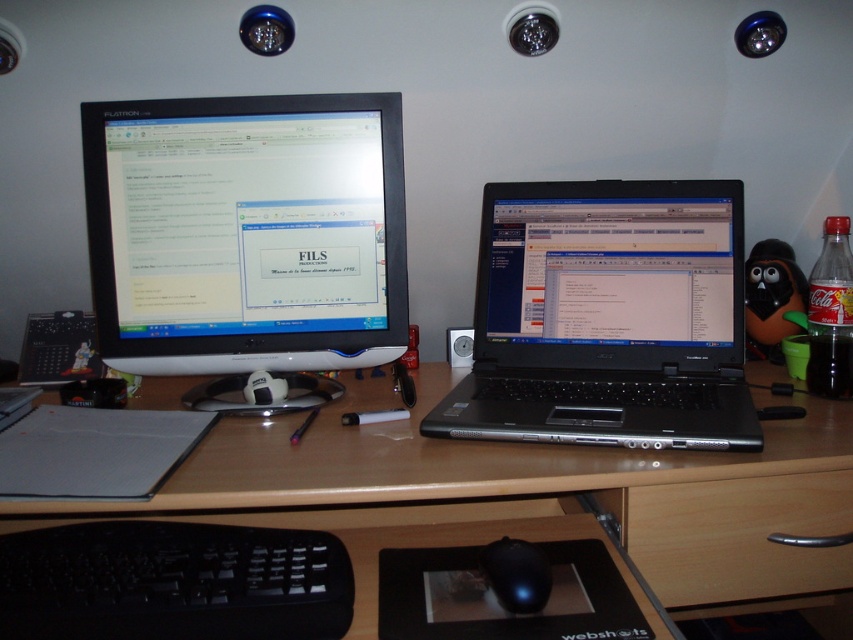
Is point (154, 609) positioned after point (469, 609)?

No, (154, 609) is closer to viewer.

Is black plastic keyboard at lower left above black matte mouse at center?

Indeed, black plastic keyboard at lower left is positioned over black matte mouse at center.

Locate an element on the screen. The image size is (853, 640). black plastic keyboard at lower left is located at coordinates [x=173, y=582].

This screenshot has height=640, width=853. Find the location of `black plastic keyboard at lower left`. black plastic keyboard at lower left is located at coordinates (173, 582).

Consider the image. Can you confirm if wooden at lower right is smaller than black matte mouse at center?

Incorrect, wooden at lower right is not smaller in size than black matte mouse at center.

Is wooden at lower right to the left of black matte mouse at center from the viewer's perspective?

In fact, wooden at lower right is to the right of black matte mouse at center.

Is point (824, 490) less distant than point (590, 572)?

No, it is behind (590, 572).

Locate an element on the screen. The height and width of the screenshot is (640, 853). wooden at lower right is located at coordinates (737, 536).

Is point (253, 481) closer to camera compared to point (656, 240)?

Yes, point (253, 481) is closer to viewer.

Is wooden at center smaller than black plastic laptop at center?

No, wooden at center is not smaller than black plastic laptop at center.

Find the location of a particular element. wooden at center is located at coordinates (521, 493).